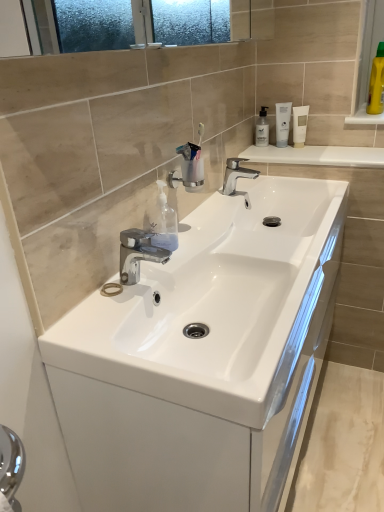
What do you see at coordinates (218, 305) in the screenshot?
I see `white glossy sink at center` at bounding box center [218, 305].

Measure the distance between point [336,158] and camera.

Point [336,158] is 1.65 meters from camera.

What do you see at coordinates (317, 156) in the screenshot? This screenshot has width=384, height=512. I see `white glossy countertop at upper center` at bounding box center [317, 156].

Find the location of a particular element. The height and width of the screenshot is (512, 384). white matte tube at upper right, positioned as the 1th mouthwash in left-to-right order is located at coordinates (282, 123).

From a real-world perspective, relative to white matte tube at upper right, which is the 3th mouthwash in right-to-left order, is white glossy sink at center vertically above or below?

From a real-world perspective, white glossy sink at center is physically below white matte tube at upper right, which is the 3th mouthwash in right-to-left order.

From the image's perspective, would you say white glossy sink at center is shown under white matte tube at upper right, which is the 3th mouthwash in right-to-left order?

Yes, from the image's perspective, white glossy sink at center is beneath white matte tube at upper right, which is the 3th mouthwash in right-to-left order.

Is white glossy sink at center oriented away from white matte tube at upper right, positioned as the 1th mouthwash in left-to-right order?

No, white glossy sink at center's orientation is not away from white matte tube at upper right, positioned as the 1th mouthwash in left-to-right order.

Is white glossy sink at center at the left side of white matte tube at upper right, which is the 3th mouthwash in right-to-left order?

Yes.

Is white matte tube at upper right, which is the 3th mouthwash in right-to-left order, oriented towards transparent plastic soap dispenser at center?

No, white matte tube at upper right, which is the 3th mouthwash in right-to-left order, is not oriented towards transparent plastic soap dispenser at center.

In the scene shown: Would you consider white matte tube at upper right, positioned as the 1th mouthwash in left-to-right order, to be distant from transparent plastic soap dispenser at center?

No, there isn't a large distance between white matte tube at upper right, positioned as the 1th mouthwash in left-to-right order, and transparent plastic soap dispenser at center.

Is point (282, 110) closer or farther from the camera than point (161, 229)?

Point (282, 110) is farther from the camera than point (161, 229).

Where is `mouthwash that is the 3rd one when counting backward from the transparent plastic soap dispenser at center`? The width and height of the screenshot is (384, 512). mouthwash that is the 3rd one when counting backward from the transparent plastic soap dispenser at center is located at coordinates 282,123.

Is white matte tube at upper right, the second mouthwash from the right, at the right side of transparent plastic bottle at upper right?

Correct, you'll find white matte tube at upper right, the second mouthwash from the right, to the right of transparent plastic bottle at upper right.

Is white matte tube at upper right, which appears as the second mouthwash when viewed from the left, looking in the opposite direction of transparent plastic bottle at upper right?

No, white matte tube at upper right, which appears as the second mouthwash when viewed from the left,'s orientation is not away from transparent plastic bottle at upper right.

Looking at this image, how distant is transparent plastic soap dispenser at center from chrome metallic faucet at center, the 2th tap viewed from the right?

The distance of transparent plastic soap dispenser at center from chrome metallic faucet at center, the 2th tap viewed from the right, is 2.80 inches.

Would you say transparent plastic soap dispenser at center contains chrome metallic faucet at center, the first tap in the bottom-to-top sequence?

No.

Could you tell me if transparent plastic soap dispenser at center is turned towards chrome metallic faucet at center, the second tap viewed from the back?

No, transparent plastic soap dispenser at center does not turn towards chrome metallic faucet at center, the second tap viewed from the back.

From the image's perspective, is white glossy sink at center located beneath transparent plastic bottle at upper right?

Yes, from the image's perspective, white glossy sink at center is beneath transparent plastic bottle at upper right.

Is white glossy sink at center inside or outside of transparent plastic bottle at upper right?

The correct answer is: outside.

Which object is positioned more to the right, white glossy sink at center or transparent plastic bottle at upper right?

transparent plastic bottle at upper right is more to the right.

Can you tell me how much white glossy sink at center and transparent plastic bottle at upper right differ in facing direction?

There is a 89.7-degree angle between the facing directions of white glossy sink at center and transparent plastic bottle at upper right.

From the picture: Is transparent plastic soap dispenser at center inside the boundaries of white glossy sink at center, or outside?

transparent plastic soap dispenser at center lies outside white glossy sink at center.

Is point (177, 223) closer to viewer compared to point (201, 283)?

No, it is not.

Considering the sizes of objects transparent plastic soap dispenser at center and white glossy sink at center in the image provided, who is shorter, transparent plastic soap dispenser at center or white glossy sink at center?

With less height is white glossy sink at center.

Would you say polished chrome tap at center, the 2th tap when ordered from left to right, is inside or outside chrome metallic faucet at center, the 1th tap from the front?

polished chrome tap at center, the 2th tap when ordered from left to right, exists outside the volume of chrome metallic faucet at center, the 1th tap from the front.

Does polished chrome tap at center, arranged as the first tap when viewed from the right, turn towards chrome metallic faucet at center, the second tap viewed from the back?

No, polished chrome tap at center, arranged as the first tap when viewed from the right, is not facing towards chrome metallic faucet at center, the second tap viewed from the back.

Can you tell me how much polished chrome tap at center, arranged as the second tap when ordered from the bottom, and chrome metallic faucet at center, the first tap in the bottom-to-top sequence, differ in facing direction?

3.26 degrees separate the facing orientations of polished chrome tap at center, arranged as the second tap when ordered from the bottom, and chrome metallic faucet at center, the first tap in the bottom-to-top sequence.

From the image's perspective, is polished chrome tap at center, the 2th tap when ordered from left to right, located above or below chrome metallic faucet at center, the 2th tap viewed from the right?

Based on their image positions, polished chrome tap at center, the 2th tap when ordered from left to right, is located above chrome metallic faucet at center, the 2th tap viewed from the right.

From the image's perspective, count 2nd mouthwashs upward from the white glossy sink at center and point to it. Please provide its 2D coordinates.

[(282, 123)]

At what (x,y) coordinates should I click in order to perform the action: click on cleaning product located in front of the white matte tube at upper right, which is the 3th mouthwash in right-to-left order. Please return your answer as a coordinate pair (x, y). This screenshot has height=512, width=384. Looking at the image, I should click on (164, 222).

Considering their positions, is yellow plastic bottle at upper right, the third mouthwash from the left, positioned closer to white matte tube at upper right, the second mouthwash from the right, than transparent plastic bottle at upper right?

Among the two, transparent plastic bottle at upper right is located nearer to white matte tube at upper right, the second mouthwash from the right.

Considering their positions, is white matte tube at upper right, which is the 3th mouthwash in right-to-left order, positioned closer to white glossy sink at center than polished chrome tap at center, marked as the 1th tap in a top-to-bottom arrangement?

Based on the image, polished chrome tap at center, marked as the 1th tap in a top-to-bottom arrangement, appears to be nearer to white glossy sink at center.

Considering their positions, is white matte tube at upper right, positioned as the 1th mouthwash in left-to-right order, positioned closer to transparent plastic bottle at upper right than yellow plastic bottle at upper right, which is the first mouthwash from right to left?

Based on the image, white matte tube at upper right, positioned as the 1th mouthwash in left-to-right order, appears to be nearer to transparent plastic bottle at upper right.

Estimate the real-world distances between objects in this image. Which object is closer to polished chrome tap at center, which is the 2th tap in front-to-back order, white matte tube at upper right, positioned as the 1th mouthwash in left-to-right order, or yellow plastic bottle at upper right, the third mouthwash from the left?

Among the two, white matte tube at upper right, positioned as the 1th mouthwash in left-to-right order, is located nearer to polished chrome tap at center, which is the 2th tap in front-to-back order.

From the image, which object appears to be nearer to chrome metallic faucet at center, the first tap in the bottom-to-top sequence, white glossy countertop at upper center or transparent plastic soap dispenser at center?

Among the two, transparent plastic soap dispenser at center is located nearer to chrome metallic faucet at center, the first tap in the bottom-to-top sequence.

Considering their positions, is transparent plastic soap dispenser at center positioned further to white glossy countertop at upper center than transparent plastic bottle at upper right?

transparent plastic soap dispenser at center lies further to white glossy countertop at upper center than the other object.

Consider the image. Based on their spatial positions, is white glossy countertop at upper center or white matte tube at upper right, positioned as the 1th mouthwash in left-to-right order, further from white matte tube at upper right, the second mouthwash from the right?

Among the two, white glossy countertop at upper center is located further to white matte tube at upper right, the second mouthwash from the right.

Based on the photo, looking at the image, which one is located closer to white glossy sink at center, white matte tube at upper right, the second mouthwash from the right, or white glossy countertop at upper center?

white glossy countertop at upper center.

Locate an element on the screen. tap between transparent plastic soap dispenser at center and white glossy countertop at upper center from left to right is located at coordinates (237, 178).

You are a GUI agent. You are given a task and a screenshot of the screen. Output one action in this format:
    pyautogui.click(x=<x>, y=<y>)
    Task: Click on the cleaning product between white glossy sink at center and polished chrome tap at center, which is the 2th tap in front-to-back order, along the z-axis
    This screenshot has height=512, width=384.
    Given the screenshot: What is the action you would take?
    pyautogui.click(x=164, y=222)

The image size is (384, 512). Find the location of `counter top located between polished chrome tap at center, which is the 2th tap in front-to-back order, and yellow plastic bottle at upper right, which is the first mouthwash from right to left, in the left-right direction`. counter top located between polished chrome tap at center, which is the 2th tap in front-to-back order, and yellow plastic bottle at upper right, which is the first mouthwash from right to left, in the left-right direction is located at coordinates (317, 156).

You are a GUI agent. You are given a task and a screenshot of the screen. Output one action in this format:
    pyautogui.click(x=<x>, y=<y>)
    Task: Click on the counter top situated between white matte tube at upper right, which appears as the second mouthwash when viewed from the left, and yellow plastic bottle at upper right, the third mouthwash from the left, from left to right
    The width and height of the screenshot is (384, 512).
    Given the screenshot: What is the action you would take?
    pyautogui.click(x=317, y=156)